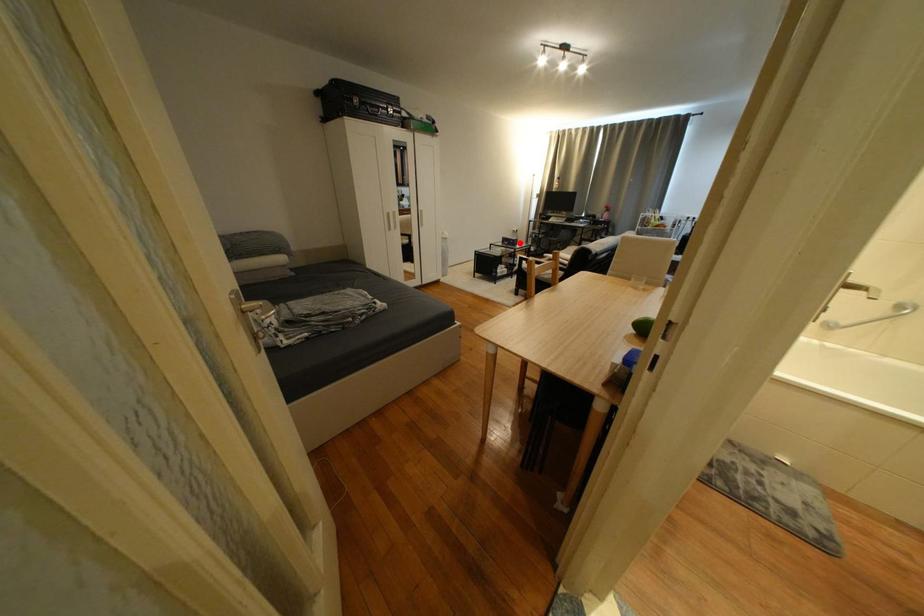
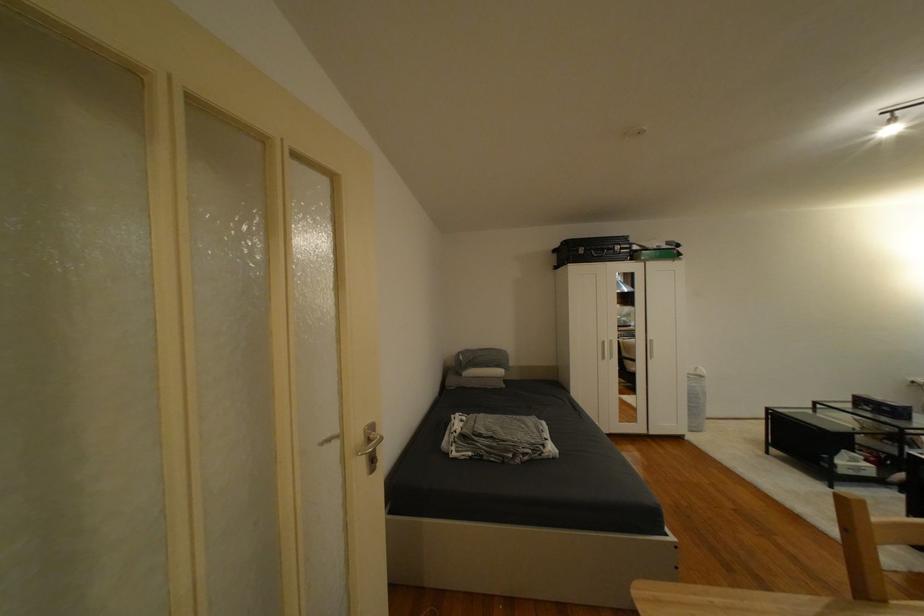
In the second image, find the point that corresponds to the highlighted location in the first image.

(894, 410)